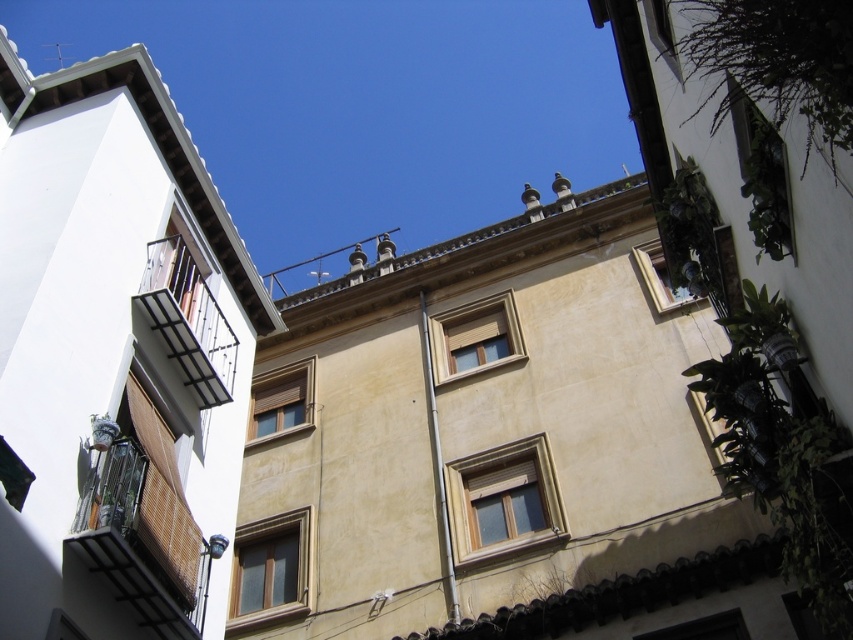
You are an architect designing a new residential complex. You want to ensure that the balconies in your design are wider than the window coverings. Based on the scene provided, does the black wrought iron balcony at left meet this requirement compared to the wooden blinds at center?

The black wrought iron balcony at left has a width larger than the wooden blinds at center, so it meets the requirement of being wider than the window coverings.

You are a delivery person trying to locate the correct apartment. You see the black wrought iron balcony at left and the wooden at center. Which one is higher up?

The black wrought iron balcony at left is located above the wooden at center, so it is higher up.

You are standing in the residential area shown in the image. You notice two points marked on the ground. The first point is at coordinates point (194,547) and the second is at point (524,442). Which point is closer to you?

Point (194,547) is in front of point (524,442), so it is closer to you.